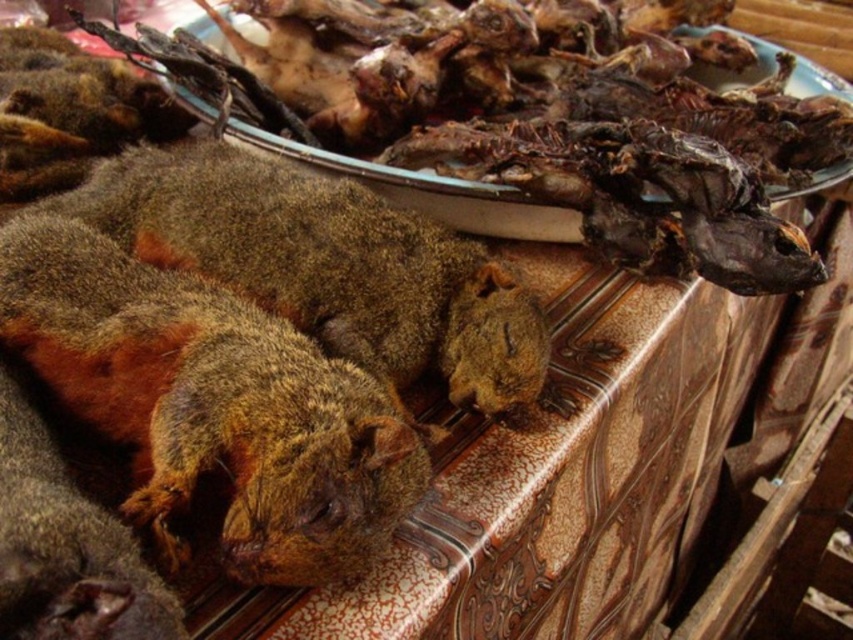
From the picture: Is brown fuzzy squirrel at lower left thinner than brown fuzzy squirrel at center?

Yes, brown fuzzy squirrel at lower left is thinner than brown fuzzy squirrel at center.

Does brown fuzzy squirrel at lower left appear on the right side of brown fuzzy squirrel at center?

Incorrect, brown fuzzy squirrel at lower left is not on the right side of brown fuzzy squirrel at center.

Identify the location of brown fuzzy squirrel at lower left. The width and height of the screenshot is (853, 640). (212, 403).

At what (x,y) coordinates should I click in order to perform the action: click on brown fuzzy squirrel at lower left. Please return your answer as a coordinate pair (x, y). Looking at the image, I should click on (212, 403).